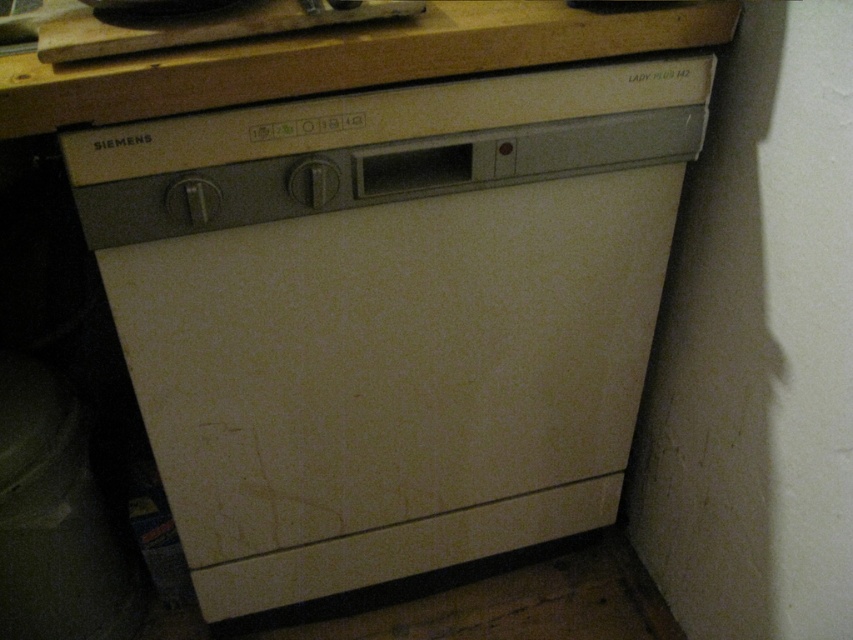
Consider the image. You are a technician trying to locate the beige matte dishwasher at center in a kitchen. According to the coordinates provided, where exactly is it positioned?

The beige matte dishwasher at center is positioned at point (390, 314).

Based on the photo, you are a kitchen designer planning to install a new appliance. You see the beige matte dishwasher at center and the wooden at upper center. Which object is located to the right of the other?

The beige matte dishwasher at center is positioned on the right side of wooden at upper center.